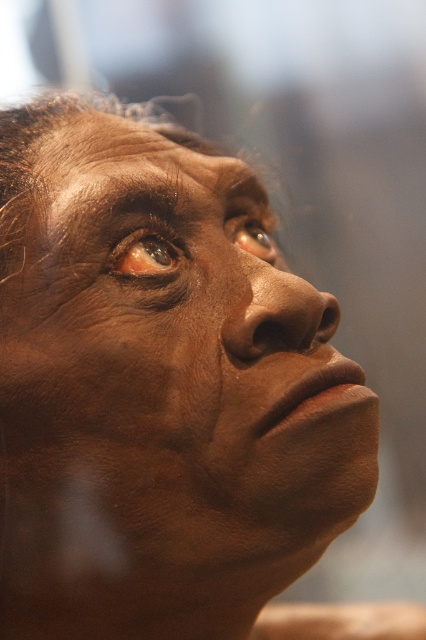
Question: Can you confirm if matte brown face at center is positioned above brown matte eye at upper center?

Choices:
 (A) no
 (B) yes

Answer: (A)

Question: Observing the image, what is the correct spatial positioning of matte brown face at center in reference to brown matte eye at upper left?

Choices:
 (A) above
 (B) below

Answer: (B)

Question: Is brown matte eye at upper left bigger than brown matte eye at upper center?

Choices:
 (A) no
 (B) yes

Answer: (A)

Question: Which object is farther from the camera taking this photo?

Choices:
 (A) brown matte eye at upper center
 (B) matte brown face at center

Answer: (A)

Question: Which object is the closest to the brown matte eye at upper center?

Choices:
 (A) matte brown face at center
 (B) brown matte eye at upper left

Answer: (B)

Question: Which point is closer to the camera taking this photo?

Choices:
 (A) (268, 250)
 (B) (135, 275)
 (C) (80, 163)

Answer: (B)